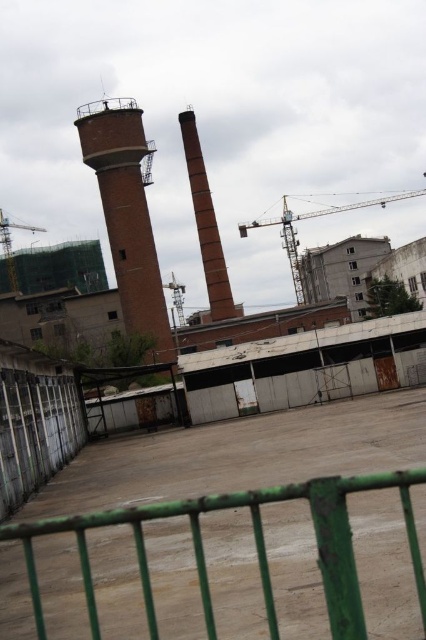
Question: Among these objects, which one is farthest from the camera?

Choices:
 (A) brick chimney at center
 (B) yellow metallic crane at center

Answer: (B)

Question: Is yellow metallic crane at center to the right of metallic gray crane at left from the viewer's perspective?

Choices:
 (A) yes
 (B) no

Answer: (A)

Question: Which object is positioned closest to the green painted metal fence at lower center?

Choices:
 (A) metallic gray crane at left
 (B) brick chimney at center

Answer: (B)

Question: From the image, what is the correct spatial relationship of brick chimney at center in relation to yellow metallic crane at center?

Choices:
 (A) left
 (B) right

Answer: (A)

Question: Which object is closer to the camera taking this photo?

Choices:
 (A) metallic gray crane at left
 (B) green painted metal fence at lower center
 (C) brick tower at center

Answer: (B)

Question: In this image, where is yellow metallic crane at center located relative to metallic gray crane at left?

Choices:
 (A) below
 (B) above

Answer: (B)